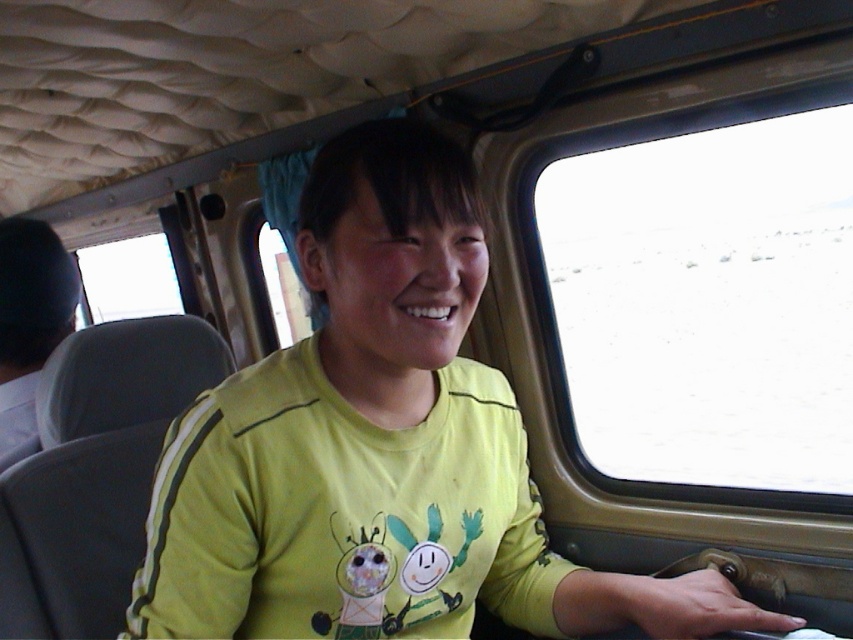
You are a passenger sitting in the vehicle and want to look outside through the transparent glass window at center. Which side of the yellow fabric shirt at center should you look towards to see the window?

The transparent glass window at center is to the right of the yellow fabric shirt at center, so you should look towards the right side of the yellow fabric shirt at center to see the window.

You are a passenger on a bus and want to locate the yellow fabric shirt at center. Where would you look relative to the center of the bus?

The yellow fabric shirt at center is located at the center of the bus, so you should look directly at the center point.

You are a passenger on a bus and want to see the outside view better. You notice two windows in the vehicle. Which window, the transparent glass window at right or the transparent glass window at upper left, is taller and thus might provide a better view?

The transparent glass window at right is taller than the transparent glass window at upper left, so it might provide a better view.